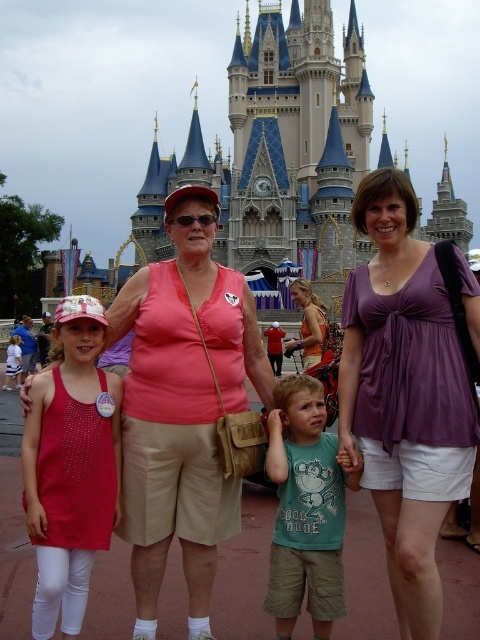
You are standing at the point marked by the coordinates (278,150) in the image. What is the nearest object to you?

The point marked by the coordinates (278,150) indicates the blue stone castle at center, so the nearest object to you is the blue stone castle at center.

You are a photographer trying to adjust the focus of your camera to capture both the purple fabric blouse at center and the teal cotton shirt at center clearly. Considering their heights, which one should you focus on first to ensure both are in focus?

The purple fabric blouse at center is taller than the teal cotton shirt at center. To ensure both are in focus, focus on the purple fabric blouse at center first as it is taller and likely further away, allowing the depth of field to cover the shorter teal cotton shirt at center.